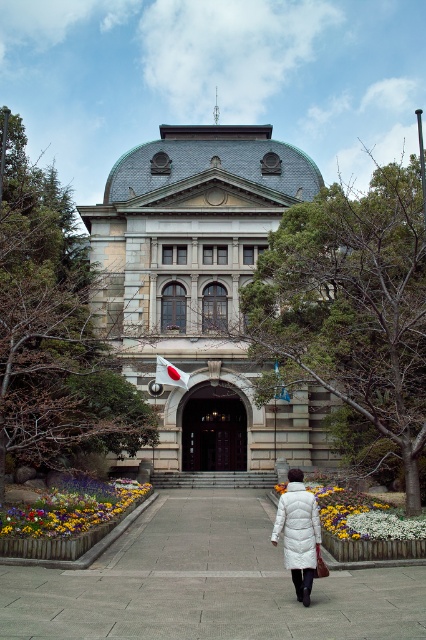
Is brown wooden door at center below floral carpet at center?

Actually, brown wooden door at center is above floral carpet at center.

Which of these two, brown wooden door at center or floral carpet at center, stands taller?

brown wooden door at center

Does point (190, 400) lie behind point (351, 534)?

Yes, point (190, 400) is behind point (351, 534).

This screenshot has height=640, width=426. In order to click on brown wooden door at center in this screenshot , I will do `click(213, 429)`.

Which of these two, brown wooden door at center or white down coat at center, stands shorter?

Standing shorter between the two is white down coat at center.

Is brown wooden door at center behind white down coat at center?

Yes.

What do you see at coordinates (213, 429) in the screenshot?
I see `brown wooden door at center` at bounding box center [213, 429].

Find the location of `brown wooden door at center`. brown wooden door at center is located at coordinates (213, 429).

The height and width of the screenshot is (640, 426). Describe the element at coordinates (206, 582) in the screenshot. I see `gray concrete pavement at center` at that location.

Who is taller, gray concrete pavement at center or brown wooden door at center?

brown wooden door at center

Locate an element on the screen. Image resolution: width=426 pixels, height=640 pixels. gray concrete pavement at center is located at coordinates (206, 582).